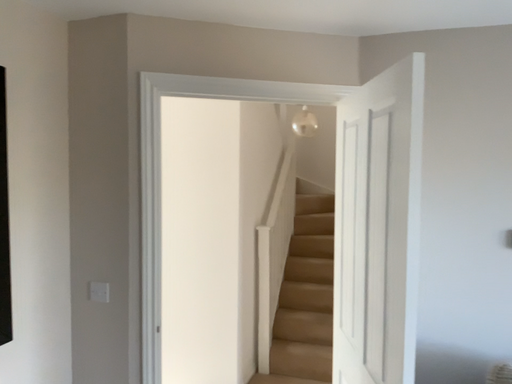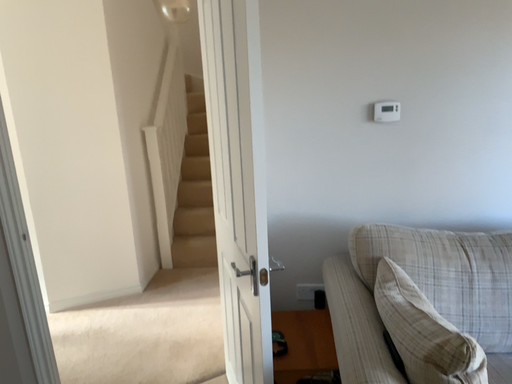
Question: Which way did the camera rotate in the video?

Choices:
 (A) rotated upward
 (B) rotated downward

Answer: (B)